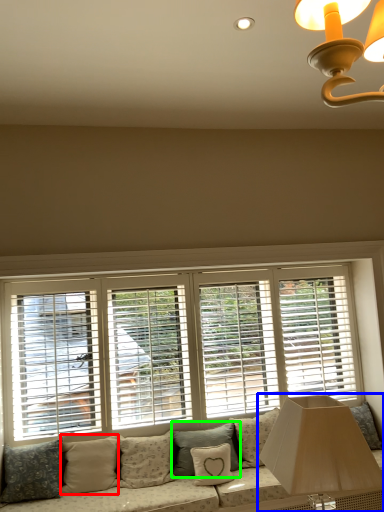
Question: Which object is the farthest from pillow (highlighted by a red box)? Choose among these: table lamp (highlighted by a blue box) or pillow (highlighted by a green box).

Choices:
 (A) table lamp
 (B) pillow

Answer: (A)